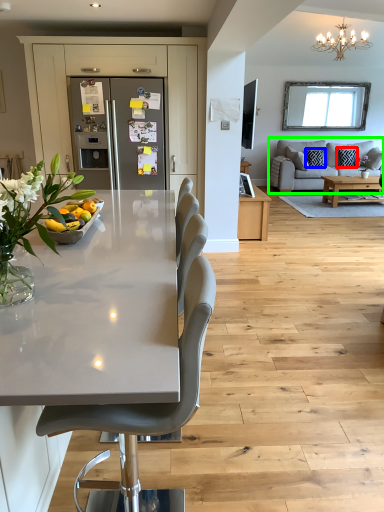
Question: Based on their relative distances, which object is farther from pillow (highlighted by a red box)? Choose from pillow (highlighted by a blue box) and studio couch (highlighted by a green box).

Choices:
 (A) pillow
 (B) studio couch

Answer: (B)